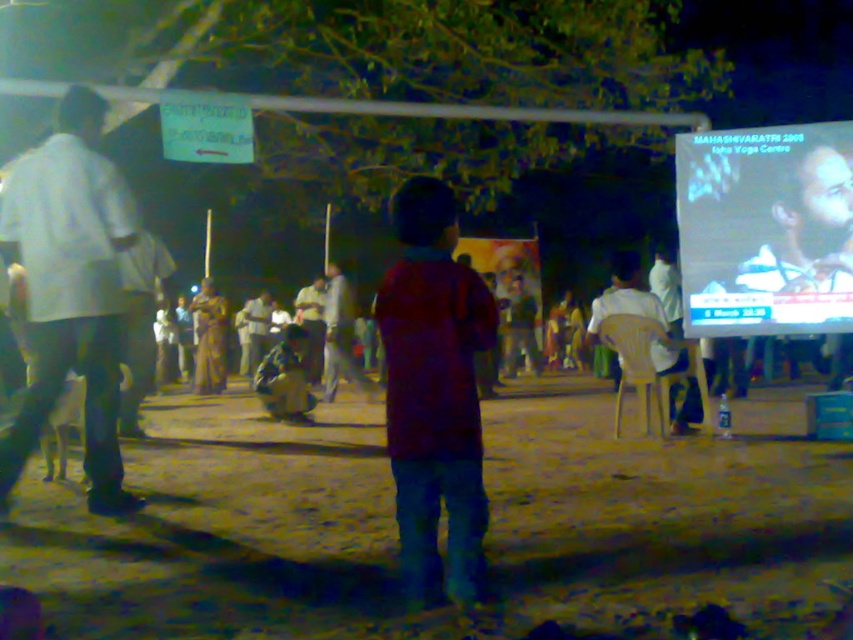
Does dark red jacket at center come in front of matte black screen at upper right?

Yes.

Does dark red jacket at center have a lesser width compared to matte black screen at upper right?

Correct, dark red jacket at center's width is less than matte black screen at upper right's.

Does point (465, 268) come farther from viewer compared to point (749, 180)?

No, (465, 268) is closer to viewer.

What are the coordinates of `dark red jacket at center` in the screenshot? It's located at (434, 394).

Between point (619, 465) and point (20, 230), which one is positioned in front?

Point (20, 230)

Is point (100, 570) closer to camera compared to point (10, 209)?

That is True.

Which is in front, point (764, 508) or point (70, 99)?

Point (70, 99)

The height and width of the screenshot is (640, 853). I want to click on brown sandy ground at center, so click(222, 532).

Which is behind, point (776, 230) or point (670, 346)?

The point (670, 346) is behind.

What do you see at coordinates (805, 228) in the screenshot? I see `smooth skin face at upper right` at bounding box center [805, 228].

Identify the location of smooth skin face at upper right. The image size is (853, 640). (805, 228).